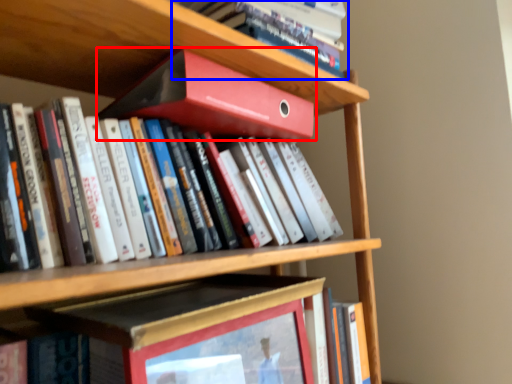
Question: Which object appears closest to the camera in this image, book (highlighted by a red box) or book (highlighted by a blue box)?

Choices:
 (A) book
 (B) book

Answer: (A)